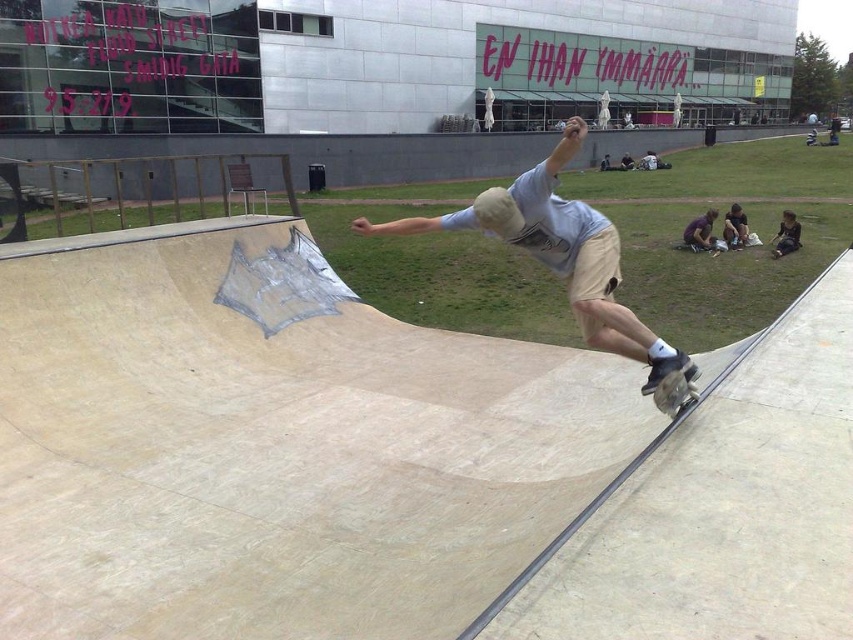
Is point (579, 310) closer to viewer compared to point (775, 237)?

Yes, it is.

Which is in front, point (567, 280) or point (799, 243)?

Positioned in front is point (567, 280).

You are a GUI agent. You are given a task and a screenshot of the screen. Output one action in this format:
    pyautogui.click(x=<x>, y=<y>)
    Task: Click on the light beige shorts at center
    
    Given the screenshot: What is the action you would take?
    pyautogui.click(x=560, y=252)

Where is `light beige shorts at center`? The width and height of the screenshot is (853, 640). light beige shorts at center is located at coordinates (560, 252).

Can you confirm if wooden textured skateboard at lower right is positioned above dark blue jeans at lower right?

No.

Which is behind, point (660, 385) or point (776, 244)?

The point (776, 244) is behind.

Identify the location of wooden textured skateboard at lower right. (676, 390).

Who is more forward, (x=596, y=337) or (x=675, y=410)?

Positioned in front is point (x=675, y=410).

Who is more distant from viewer, [585,300] or [668,400]?

The point [668,400] is behind.

Does point (625, 312) lie in front of point (682, 392)?

Yes, point (625, 312) is in front of point (682, 392).

The image size is (853, 640). Find the location of `light beige shorts at center`. light beige shorts at center is located at coordinates (560, 252).